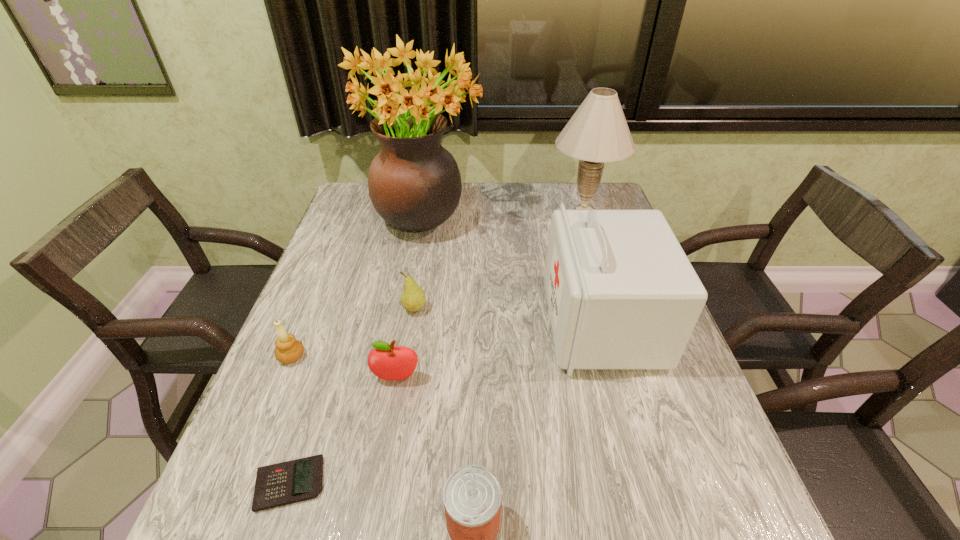
This screenshot has width=960, height=540. In order to click on candle_holder located in the left edge section of the desktop in this screenshot , I will do `click(288, 350)`.

Identify the location of calculator that is at the left edge. (280, 484).

At what (x,y) coordinates should I click in order to perform the action: click on lampshade present at the right edge. Please return your answer as a coordinate pair (x, y). The height and width of the screenshot is (540, 960). Looking at the image, I should click on (598, 132).

Image resolution: width=960 pixels, height=540 pixels. I want to click on the first-aid kit that is at the right edge, so click(x=622, y=295).

Find the location of a particular element. object that is positioned at the far left corner is located at coordinates (414, 183).

Where is `object present at the near left corner`? object present at the near left corner is located at coordinates (280, 484).

The height and width of the screenshot is (540, 960). What are the coordinates of `object positioned at the far right corner` in the screenshot? It's located at (598, 132).

In the image, there is a desktop. Where is `vacant space at the far edge`? vacant space at the far edge is located at coordinates (562, 203).

In the image, there is a desktop. Where is `vacant space at the left edge`? vacant space at the left edge is located at coordinates (252, 410).

The width and height of the screenshot is (960, 540). Identify the location of free space at the right edge of the desktop. (644, 422).